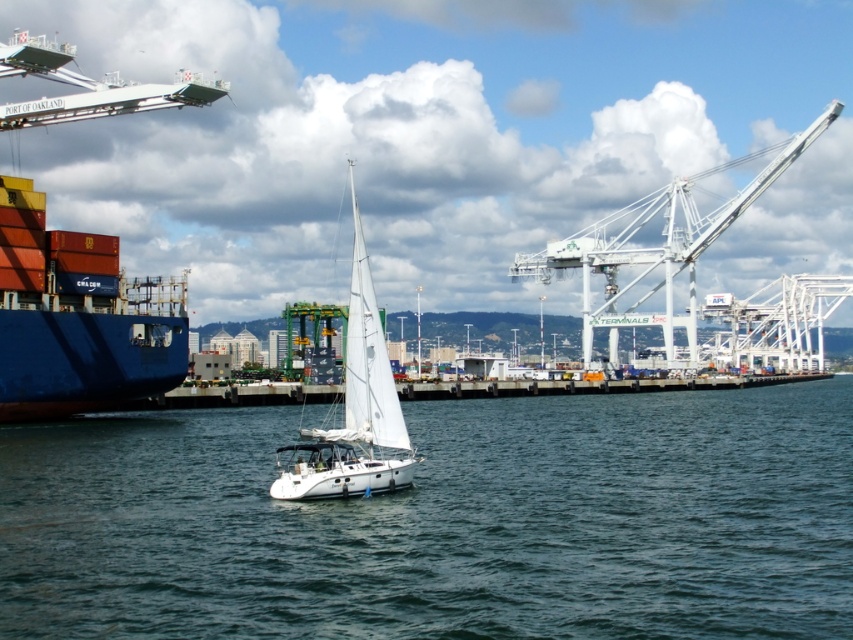
You are standing at the edge of the port and want to take a photo of both the clear blue water at center and the white metallic crane at upper right. Which object will appear larger in your photo?

The clear blue water at center will appear larger in the photo because it is closer to the viewer than the white metallic crane at upper right.